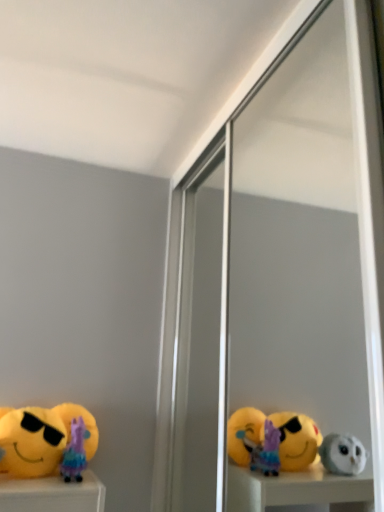
Question: Is yellow plush toy at lower left, which ranks as the 1th toy in left-to-right order, oriented towards purple fabric doll at lower left, positioned as the second toy in left-to-right order?

Choices:
 (A) no
 (B) yes

Answer: (B)

Question: Is yellow plush toy at lower left, acting as the second toy starting from the right, smaller than purple fabric doll at lower left, which is counted as the 1th toy, starting from the right?

Choices:
 (A) no
 (B) yes

Answer: (A)

Question: From the image's perspective, is yellow plush toy at lower left, which ranks as the 1th toy in left-to-right order, on top of purple fabric doll at lower left, positioned as the second toy in left-to-right order?

Choices:
 (A) yes
 (B) no

Answer: (A)

Question: Is yellow plush toy at lower left, acting as the second toy starting from the right, positioned behind purple fabric doll at lower left, positioned as the second toy in left-to-right order?

Choices:
 (A) yes
 (B) no

Answer: (B)

Question: Are yellow plush toy at lower left, acting as the second toy starting from the right, and purple fabric doll at lower left, positioned as the second toy in left-to-right order, far apart?

Choices:
 (A) yes
 (B) no

Answer: (B)

Question: Is purple fabric doll at lower left, which is counted as the 1th toy, starting from the right, in front of or behind transparent glass screen door at center in the image?

Choices:
 (A) front
 (B) behind

Answer: (B)

Question: From a real-world perspective, is purple fabric doll at lower left, which is counted as the 1th toy, starting from the right, physically located above or below transparent glass screen door at center?

Choices:
 (A) above
 (B) below

Answer: (B)

Question: Looking at their shapes, would you say purple fabric doll at lower left, positioned as the second toy in left-to-right order, is wider or thinner than transparent glass screen door at center?

Choices:
 (A) wide
 (B) thin

Answer: (B)

Question: Is point (72, 408) positioned closer to the camera than point (291, 145)?

Choices:
 (A) farther
 (B) closer

Answer: (B)

Question: Is transparent glass screen door at center in front of or behind purple fabric doll at lower left, positioned as the second toy in left-to-right order, in the image?

Choices:
 (A) behind
 (B) front

Answer: (B)

Question: In terms of size, does transparent glass screen door at center appear bigger or smaller than purple fabric doll at lower left, positioned as the second toy in left-to-right order?

Choices:
 (A) small
 (B) big

Answer: (B)

Question: From their relative heights in the image, would you say transparent glass screen door at center is taller or shorter than purple fabric doll at lower left, which is counted as the 1th toy, starting from the right?

Choices:
 (A) short
 (B) tall

Answer: (B)

Question: From a real-world perspective, is transparent glass screen door at center positioned above or below purple fabric doll at lower left, positioned as the second toy in left-to-right order?

Choices:
 (A) below
 (B) above

Answer: (B)

Question: From the image's perspective, relative to transparent glass screen door at center, is yellow plush toy at lower left, acting as the second toy starting from the right, above or below?

Choices:
 (A) above
 (B) below

Answer: (B)

Question: Considering the positions of yellow plush toy at lower left, which ranks as the 1th toy in left-to-right order, and transparent glass screen door at center in the image, is yellow plush toy at lower left, which ranks as the 1th toy in left-to-right order, wider or thinner than transparent glass screen door at center?

Choices:
 (A) wide
 (B) thin

Answer: (B)